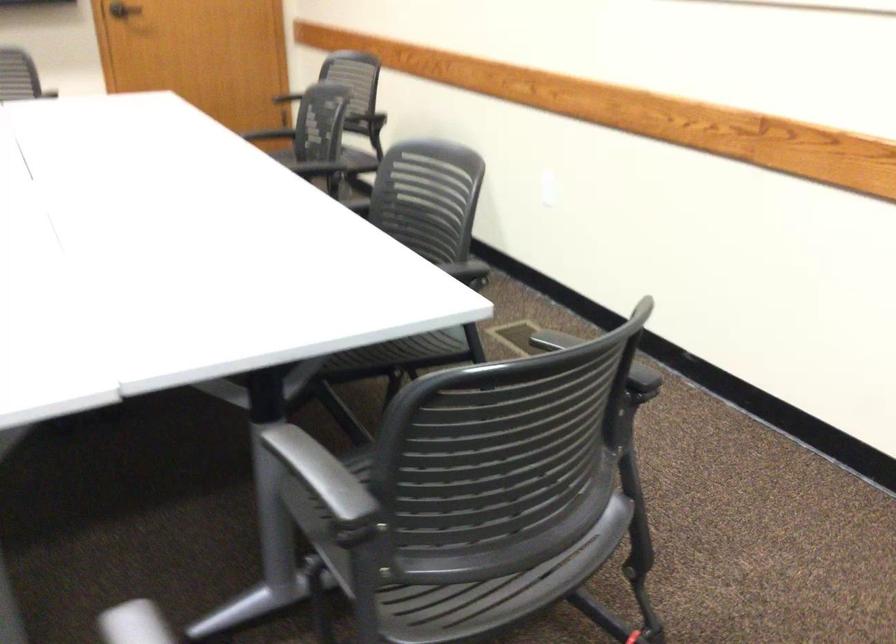
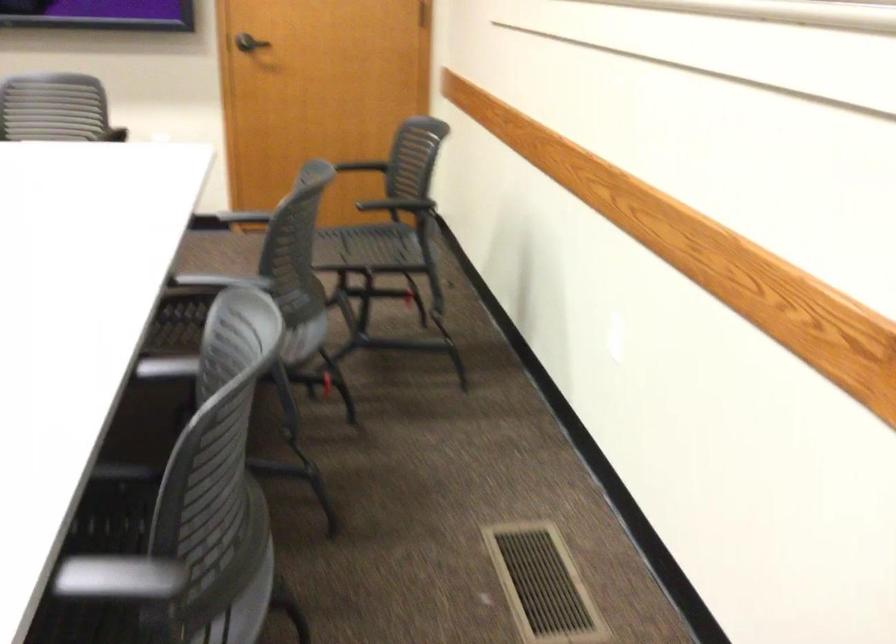
In the second image, find the point that corresponds to (x=444, y=275) in the first image.

(118, 578)